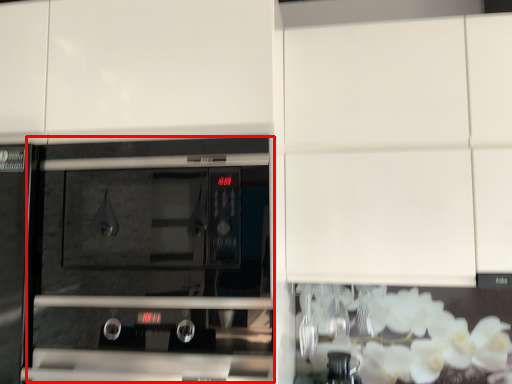
Question: From the image's perspective, considering the relative positions of oven (annotated by the red box) and cabinetry in the image provided, where is oven (annotated by the red box) located with respect to the staircase?

Choices:
 (A) below
 (B) above

Answer: (A)